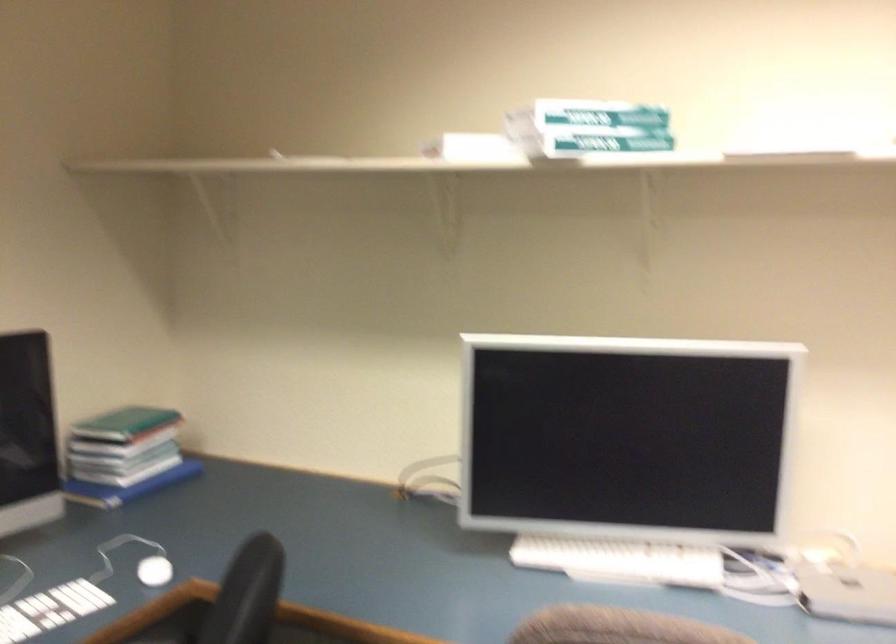
This screenshot has width=896, height=644. What are the coordinates of `white computer mouse` in the screenshot? It's located at (153, 571).